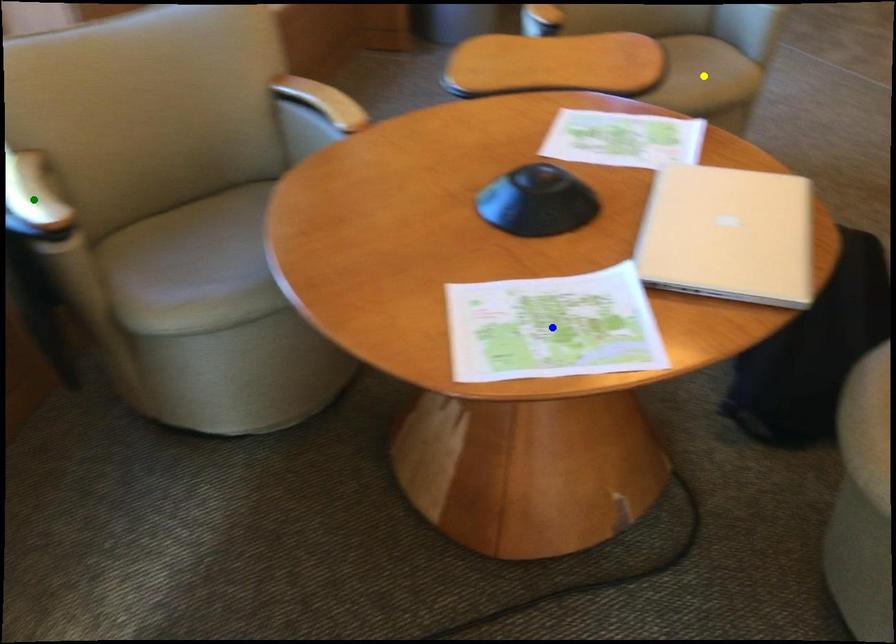
Order these from nearest to farthest:
green point, yellow point, blue point

1. blue point
2. green point
3. yellow point